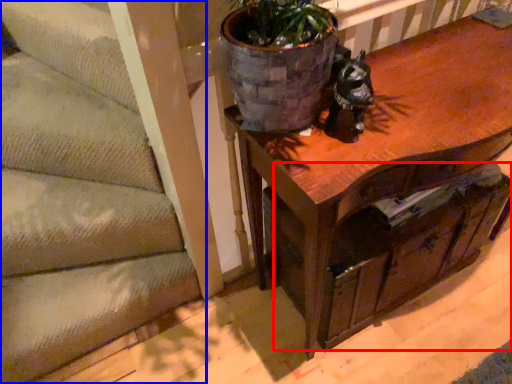
Question: Which object is further to the camera taking this photo, drawer (highlighted by a red box) or stairwell (highlighted by a blue box)?

Choices:
 (A) drawer
 (B) stairwell

Answer: (B)